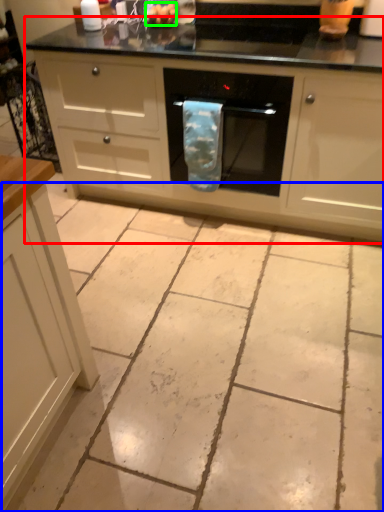
Question: Considering the real-world distances, which object is closest to oven (highlighted by a red box)? concrete (highlighted by a blue box) or food (highlighted by a green box).

Choices:
 (A) concrete
 (B) food

Answer: (A)